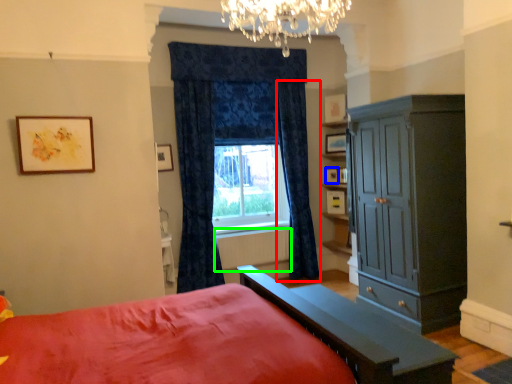
Question: Which object is the farthest from curtain (highlighted by a red box)? Choose among these: picture frame (highlighted by a blue box) or radiator (highlighted by a green box).

Choices:
 (A) picture frame
 (B) radiator

Answer: (A)